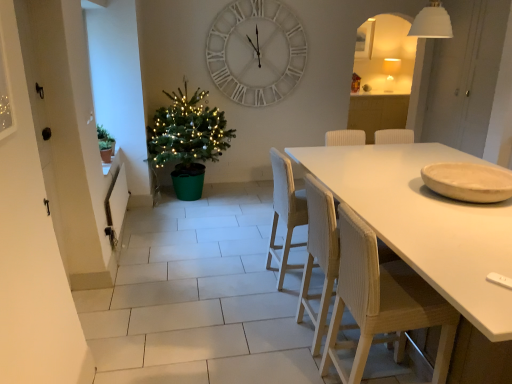
Question: Considering the relative sizes of green plastic christmas tree at left and wooden chair at center, positioned as the second chair in back-to-front order, in the image provided, is green plastic christmas tree at left taller than wooden chair at center, positioned as the second chair in back-to-front order,?

Choices:
 (A) no
 (B) yes

Answer: (B)

Question: Is green plastic christmas tree at left smaller than wooden chair at center, positioned as the second chair in back-to-front order?

Choices:
 (A) no
 (B) yes

Answer: (A)

Question: Is green plastic christmas tree at left positioned in front of wooden chair at center, acting as the 2th chair starting from the front?

Choices:
 (A) yes
 (B) no

Answer: (B)

Question: Can you confirm if green plastic christmas tree at left is bigger than wooden chair at center, acting as the 2th chair starting from the front?

Choices:
 (A) no
 (B) yes

Answer: (B)

Question: Considering the relative sizes of green plastic christmas tree at left and wooden chair at center, positioned as the second chair in back-to-front order, in the image provided, is green plastic christmas tree at left thinner than wooden chair at center, positioned as the second chair in back-to-front order,?

Choices:
 (A) yes
 (B) no

Answer: (B)

Question: In terms of height, does white matte table at center look taller or shorter compared to white woven chair at center, marked as the 1th chair in a back-to-front arrangement?

Choices:
 (A) short
 (B) tall

Answer: (A)

Question: From a real-world perspective, is white matte table at center positioned above or below white woven chair at center, positioned as the 3th chair in front-to-back order?

Choices:
 (A) above
 (B) below

Answer: (B)

Question: Which is correct: white matte table at center is inside white woven chair at center, marked as the 1th chair in a back-to-front arrangement, or outside of it?

Choices:
 (A) outside
 (B) inside

Answer: (A)

Question: From the image's perspective, relative to white woven chair at center, marked as the 1th chair in a back-to-front arrangement, is white matte table at center above or below?

Choices:
 (A) above
 (B) below

Answer: (B)

Question: Is point (392, 67) closer or farther from the camera than point (114, 142)?

Choices:
 (A) closer
 (B) farther

Answer: (B)

Question: From a real-world perspective, relative to green matte plant at left, is matte white lampshade at upper right vertically above or below?

Choices:
 (A) below
 (B) above

Answer: (B)

Question: Looking at their shapes, would you say matte white lampshade at upper right is wider or thinner than green matte plant at left?

Choices:
 (A) thin
 (B) wide

Answer: (B)

Question: Do you think matte white lampshade at upper right is within green matte plant at left, or outside of it?

Choices:
 (A) outside
 (B) inside

Answer: (A)

Question: Which is correct: white woven chair at center, marked as the 1th chair in a back-to-front arrangement, is inside wooden chair at lower right, arranged as the 3th chair when viewed from the back, or outside of it?

Choices:
 (A) inside
 (B) outside

Answer: (B)

Question: In terms of size, does white woven chair at center, positioned as the 3th chair in front-to-back order, appear bigger or smaller than wooden chair at lower right, arranged as the 3th chair when viewed from the back?

Choices:
 (A) big
 (B) small

Answer: (A)